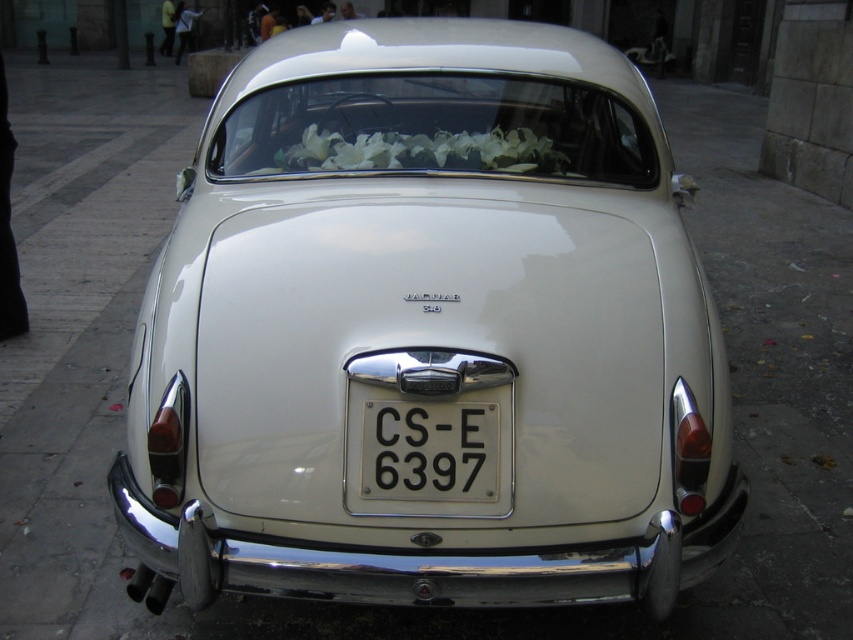
Between satin white car at center and white floral garland at center, which one is positioned lower?

satin white car at center is below.

Is satin white car at center smaller than white floral garland at center?

Actually, satin white car at center might be larger than white floral garland at center.

Is point (514, 88) behind point (531, 150)?

Yes, it is.

I want to click on satin white car at center, so click(x=428, y=336).

Who is positioned more to the right, black metal license plate at center or white floral garland at center?

From the viewer's perspective, black metal license plate at center appears more on the right side.

Can you confirm if black metal license plate at center is bigger than white floral garland at center?

Incorrect, black metal license plate at center is not larger than white floral garland at center.

Identify the location of black metal license plate at center. (430, 451).

Measure the distance from satin white car at center to black metal license plate at center.

They are 21.59 inches apart.

Is satin white car at center further to camera compared to black metal license plate at center?

No, it is in front of black metal license plate at center.

The image size is (853, 640). Find the location of `satin white car at center`. satin white car at center is located at coordinates (428, 336).